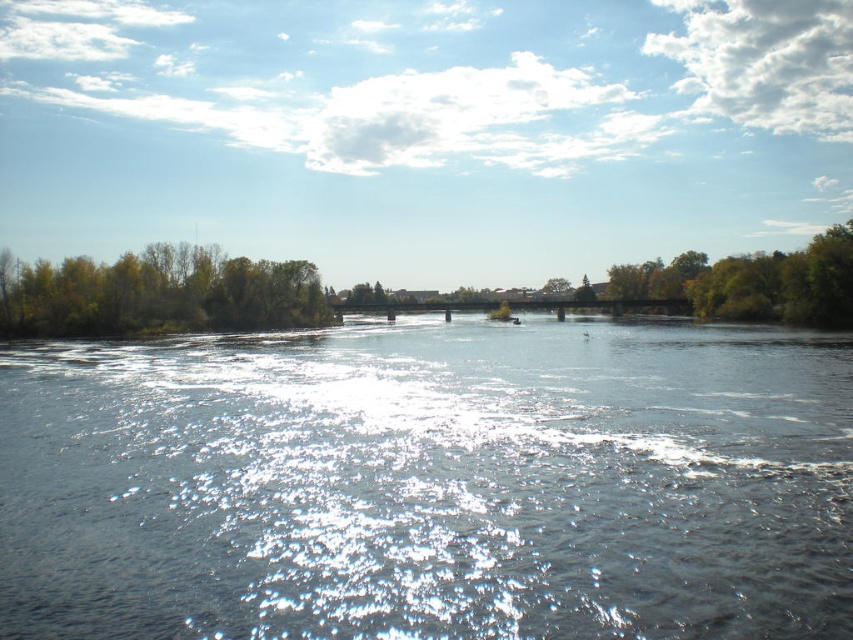
Question: Can you confirm if clear water at center is bigger than green leafy tree at right?

Choices:
 (A) no
 (B) yes

Answer: (A)

Question: Does clear water at center appear over green leafy tree at right?

Choices:
 (A) yes
 (B) no

Answer: (B)

Question: Which is farther from the green leafy tree at right?

Choices:
 (A) green leafy trees at left
 (B) clear water at center

Answer: (A)

Question: Is green leafy trees at left positioned at the back of green leafy tree at right?

Choices:
 (A) yes
 (B) no

Answer: (A)

Question: Which point is closer to the camera?

Choices:
 (A) (236, 436)
 (B) (84, 294)

Answer: (A)

Question: Based on their relative distances, which object is farther from the clear water at center?

Choices:
 (A) green leafy trees at left
 (B) green leafy tree at right

Answer: (B)